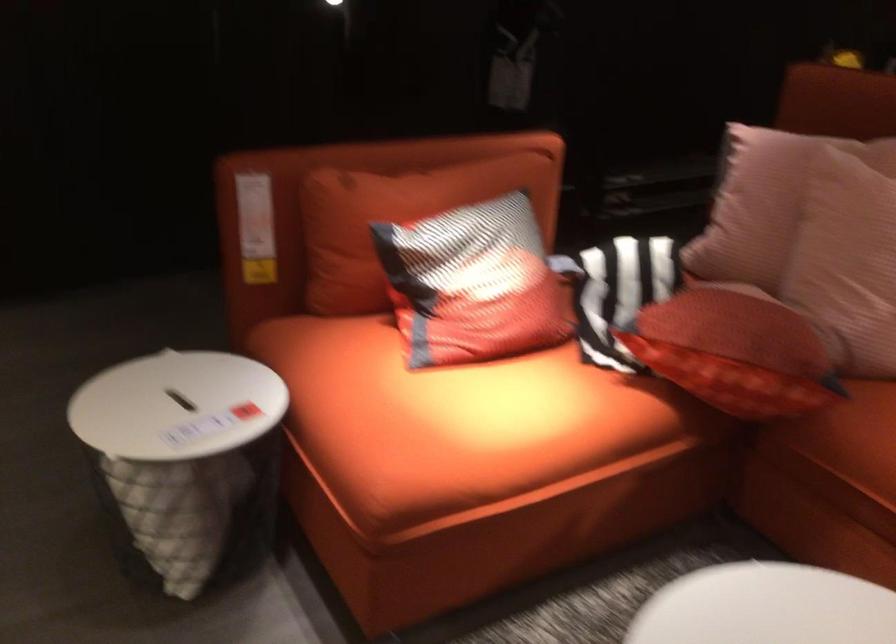
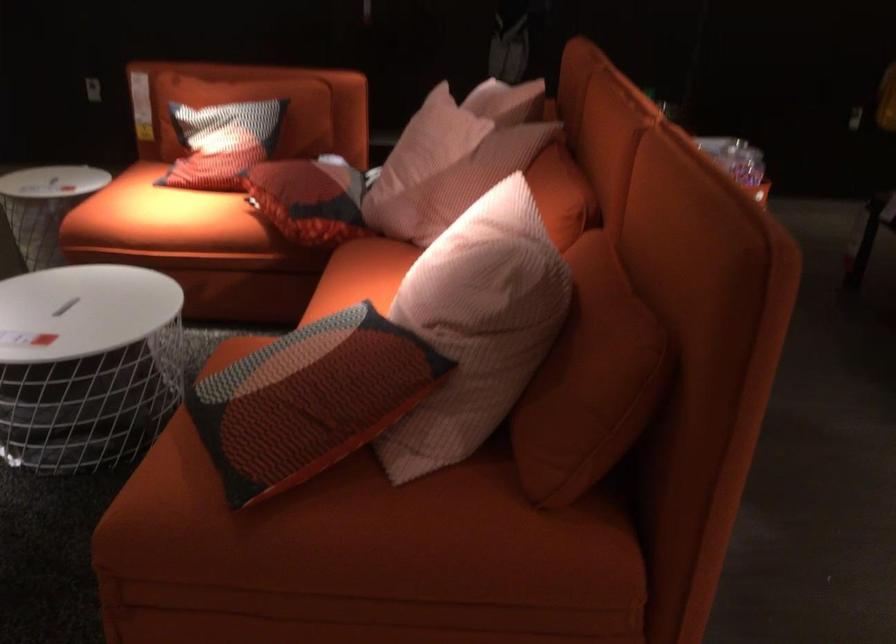
Where in the second image is the point corresponding to point 497,276 from the first image?

(222, 142)